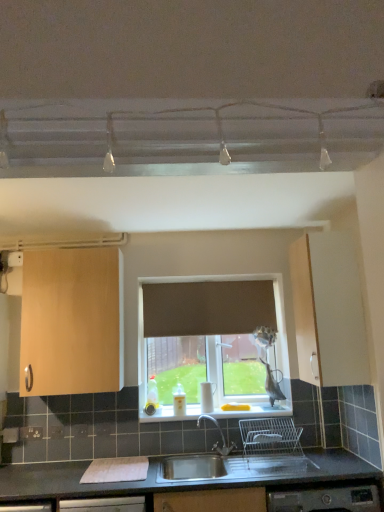
Image resolution: width=384 pixels, height=512 pixels. I want to click on white glossy window sill at center, so [x=219, y=412].

The width and height of the screenshot is (384, 512). Describe the element at coordinates (328, 310) in the screenshot. I see `matte wood cabinet at right, the 2th cabinetry viewed from the left` at that location.

Locate an element on the screen. white plastic electric outlet at lower left is located at coordinates (30, 433).

The image size is (384, 512). What are the coordinates of `brown fabric curtain at center` in the screenshot? It's located at (208, 307).

Where is `light wood cabinet at left, which is the 2th cabinetry in right-to-left order`? light wood cabinet at left, which is the 2th cabinetry in right-to-left order is located at coordinates (72, 322).

Would you say stainless steel sink at lower center contains brown fabric curtain at center?

No, brown fabric curtain at center is located outside of stainless steel sink at lower center.

Is the depth of stainless steel sink at lower center less than that of brown fabric curtain at center?

Yes, the depth of stainless steel sink at lower center is less than that of brown fabric curtain at center.

Is stainless steel sink at lower center oriented towards brown fabric curtain at center?

No, stainless steel sink at lower center is not aimed at brown fabric curtain at center.

Can you confirm if stainless steel sink at lower center is bigger than brown fabric curtain at center?

Yes, stainless steel sink at lower center is bigger than brown fabric curtain at center.

Considering the sizes of objects light wood cabinet at left, which is the 2th cabinetry in right-to-left order, and stainless steel sink at lower center in the image provided, who is thinner, light wood cabinet at left, which is the 2th cabinetry in right-to-left order, or stainless steel sink at lower center?

light wood cabinet at left, which is the 2th cabinetry in right-to-left order, is thinner.

Considering the relative sizes of light wood cabinet at left, which is the 2th cabinetry in right-to-left order, and stainless steel sink at lower center in the image provided, is light wood cabinet at left, which is the 2th cabinetry in right-to-left order, smaller than stainless steel sink at lower center?

Correct, light wood cabinet at left, which is the 2th cabinetry in right-to-left order, occupies less space than stainless steel sink at lower center.

Could you tell me if light wood cabinet at left, positioned as the first cabinetry in left-to-right order, is turned towards stainless steel sink at lower center?

No, light wood cabinet at left, positioned as the first cabinetry in left-to-right order, is not facing towards stainless steel sink at lower center.

Is point (117, 365) behind point (244, 436)?

That is False.

Between white glossy window sill at center and stainless steel sink at lower center, which one has more height?

stainless steel sink at lower center.

Looking at this image, does white glossy window sill at center appear on the left side of stainless steel sink at lower center?

Correct, you'll find white glossy window sill at center to the left of stainless steel sink at lower center.

Does white glossy window sill at center touch stainless steel sink at lower center?

No.

Does white glossy window sill at center contain stainless steel sink at lower center?

Actually, stainless steel sink at lower center is outside white glossy window sill at center.

Is white plastic electric outlet at lower left spatially inside light wood cabinet at left, which is the 2th cabinetry in right-to-left order, or outside of it?

white plastic electric outlet at lower left is outside light wood cabinet at left, which is the 2th cabinetry in right-to-left order.

How different are the orientations of white plastic electric outlet at lower left and light wood cabinet at left, positioned as the first cabinetry in left-to-right order, in degrees?

There is a 0.0097-degree angle between the facing directions of white plastic electric outlet at lower left and light wood cabinet at left, positioned as the first cabinetry in left-to-right order.

Could you tell me if white plastic electric outlet at lower left is turned towards light wood cabinet at left, which is the 2th cabinetry in right-to-left order?

No, white plastic electric outlet at lower left does not turn towards light wood cabinet at left, which is the 2th cabinetry in right-to-left order.

Looking at this image, is the position of white plastic electric outlet at lower left more distant than that of light wood cabinet at left, positioned as the first cabinetry in left-to-right order?

Yes.

From the picture: Which of these two, white plastic electric outlet at lower left or stainless steel sink at lower center, stands taller?

stainless steel sink at lower center.

Are white plastic electric outlet at lower left and stainless steel sink at lower center far apart?

That's right, there is a large distance between white plastic electric outlet at lower left and stainless steel sink at lower center.

Is point (39, 433) positioned behind point (206, 416)?

No, (39, 433) is closer to viewer.

Is white plastic electric outlet at lower left in front of or behind stainless steel sink at lower center in the image?

white plastic electric outlet at lower left is positioned farther from the viewer than stainless steel sink at lower center.

Is white glossy window sill at center a part of stainless steel sink at lower center?

No, white glossy window sill at center is not surrounded by stainless steel sink at lower center.

Which is farther, (278, 472) or (147, 417)?

The point (147, 417) is behind.

From the picture: Is stainless steel sink at lower center wider or thinner than white glossy window sill at center?

In the image, stainless steel sink at lower center appears to be wider than white glossy window sill at center.

Would you say stainless steel sink at lower center is a long distance from white glossy window sill at center?

No, stainless steel sink at lower center is in close proximity to white glossy window sill at center.

From a real-world perspective, is white glossy window sill at center above or below matte wood cabinet at right, which appears as the first cabinetry when viewed from the right?

Clearly, from a real-world perspective, white glossy window sill at center is below matte wood cabinet at right, which appears as the first cabinetry when viewed from the right.

Which point is more forward, (x=170, y=409) or (x=309, y=293)?

Point (x=309, y=293)

Which object is positioned more to the left, white glossy window sill at center or matte wood cabinet at right, which appears as the first cabinetry when viewed from the right?

From the viewer's perspective, white glossy window sill at center appears more on the left side.

Does white glossy window sill at center have a smaller size compared to matte wood cabinet at right, the 2th cabinetry viewed from the left?

Yes.

Where is `sink located on the right of brown fabric curtain at center`? The height and width of the screenshot is (512, 384). sink located on the right of brown fabric curtain at center is located at coordinates (245, 454).

From the image's perspective, which cabinetry is the 1st one above the stainless steel sink at lower center? Please provide its 2D coordinates.

[(72, 322)]

Considering their positions, is white glossy window sill at center positioned further to matte wood cabinet at right, the 2th cabinetry viewed from the left, than white plastic electric outlet at lower left?

white plastic electric outlet at lower left lies further to matte wood cabinet at right, the 2th cabinetry viewed from the left, than the other object.

Looking at the image, which one is located closer to matte wood cabinet at right, which appears as the first cabinetry when viewed from the right, light wood cabinet at left, positioned as the first cabinetry in left-to-right order, or stainless steel sink at lower center?

Based on the image, stainless steel sink at lower center appears to be nearer to matte wood cabinet at right, which appears as the first cabinetry when viewed from the right.

When comparing their distances from white glossy window sill at center, does brown fabric curtain at center or stainless steel sink at lower center seem closer?

The object closer to white glossy window sill at center is stainless steel sink at lower center.

Based on their spatial positions, is white glossy window sill at center or stainless steel sink at lower center closer to light wood cabinet at left, which is the 2th cabinetry in right-to-left order?

Among the two, white glossy window sill at center is located nearer to light wood cabinet at left, which is the 2th cabinetry in right-to-left order.

Based on their spatial positions, is brown fabric curtain at center or stainless steel sink at lower center further from light wood cabinet at left, which is the 2th cabinetry in right-to-left order?

The object further to light wood cabinet at left, which is the 2th cabinetry in right-to-left order, is stainless steel sink at lower center.

Looking at the image, which one is located closer to light wood cabinet at left, which is the 2th cabinetry in right-to-left order, matte wood cabinet at right, which appears as the first cabinetry when viewed from the right, or white plastic electric outlet at lower left?

The object closer to light wood cabinet at left, which is the 2th cabinetry in right-to-left order, is white plastic electric outlet at lower left.

From the image, which object appears to be nearer to brown fabric curtain at center, white plastic electric outlet at lower left or matte wood cabinet at right, the 2th cabinetry viewed from the left?

Based on the image, matte wood cabinet at right, the 2th cabinetry viewed from the left, appears to be nearer to brown fabric curtain at center.

When comparing their distances from stainless steel sink at lower center, does white plastic electric outlet at lower left or light wood cabinet at left, positioned as the first cabinetry in left-to-right order, seem further?

white plastic electric outlet at lower left is positioned further to the anchor stainless steel sink at lower center.

Locate an element on the screen. This screenshot has height=512, width=384. cabinetry between white plastic electric outlet at lower left and stainless steel sink at lower center is located at coordinates (72, 322).

I want to click on cabinetry located between white plastic electric outlet at lower left and white glossy window sill at center in the left-right direction, so click(72, 322).

Locate an element on the screen. window sill between white plastic electric outlet at lower left and stainless steel sink at lower center is located at coordinates (219, 412).

At what (x,y) coordinates should I click in order to perform the action: click on window sill between light wood cabinet at left, which is the 2th cabinetry in right-to-left order, and matte wood cabinet at right, which appears as the first cabinetry when viewed from the right, in the horizontal direction. Please return your answer as a coordinate pair (x, y). The height and width of the screenshot is (512, 384). Looking at the image, I should click on coord(219,412).